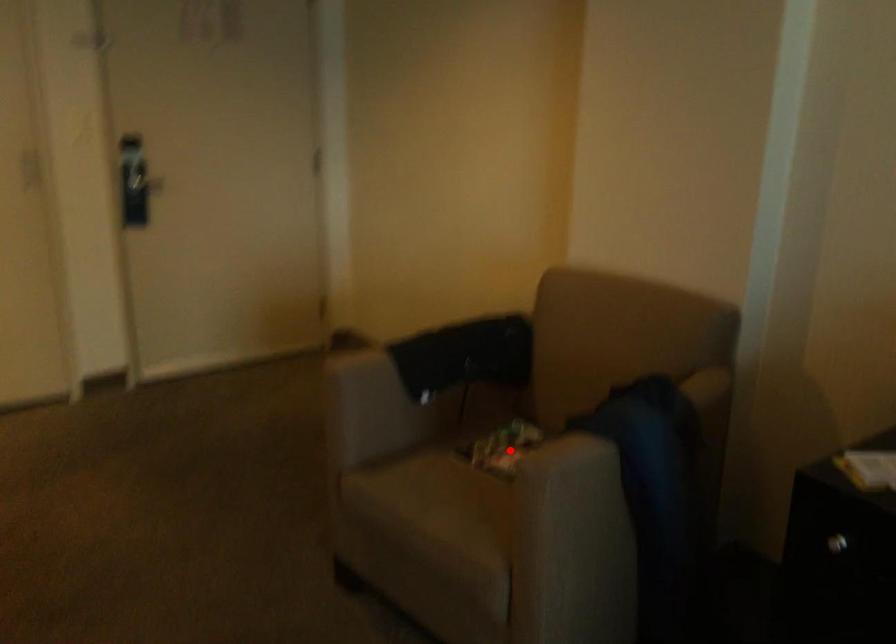
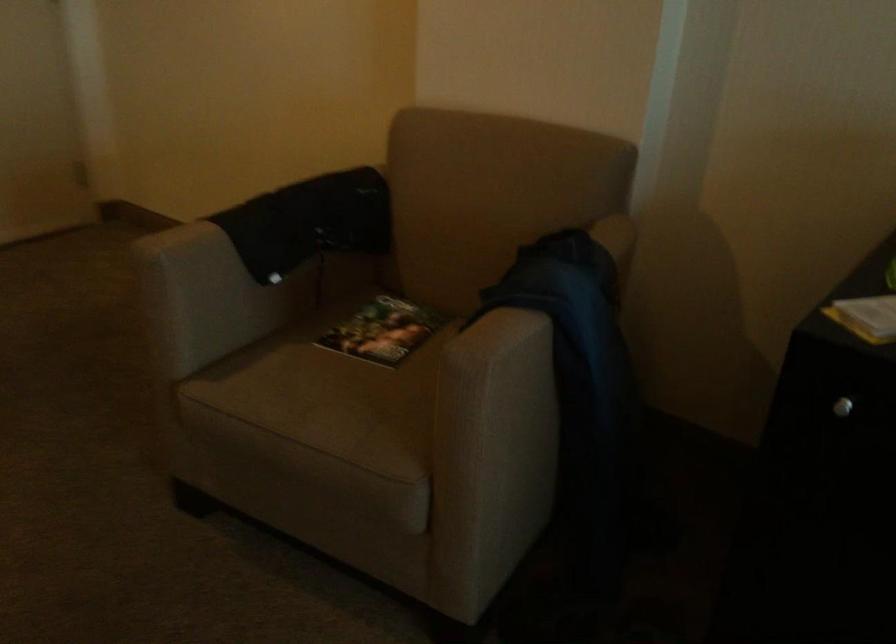
Question: I am providing you with two images of the same scene from different viewpoints. A red point is shown in image1. For the corresponding object point in image2, is it positioned nearer or farther from the camera?

Choices:
 (A) Nearer
 (B) Farther

Answer: (A)